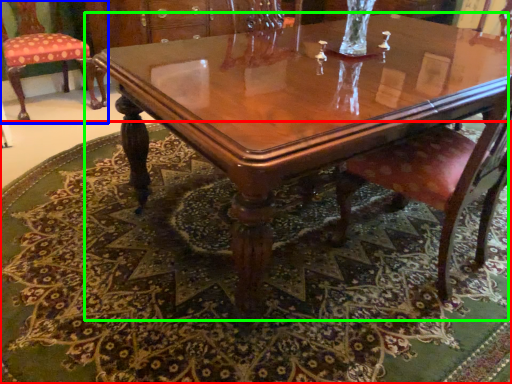
Question: Which object is the farthest from mat (highlighted by a red box)? Choose among these: chair (highlighted by a blue box) or coffee table (highlighted by a green box).

Choices:
 (A) chair
 (B) coffee table

Answer: (A)